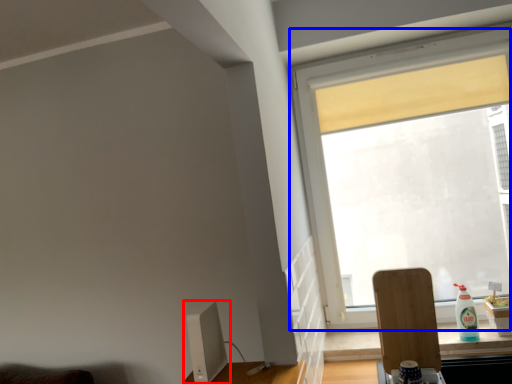
Question: Which object is further to the camera taking this photo, computer monitor (highlighted by a red box) or window (highlighted by a blue box)?

Choices:
 (A) computer monitor
 (B) window

Answer: (B)